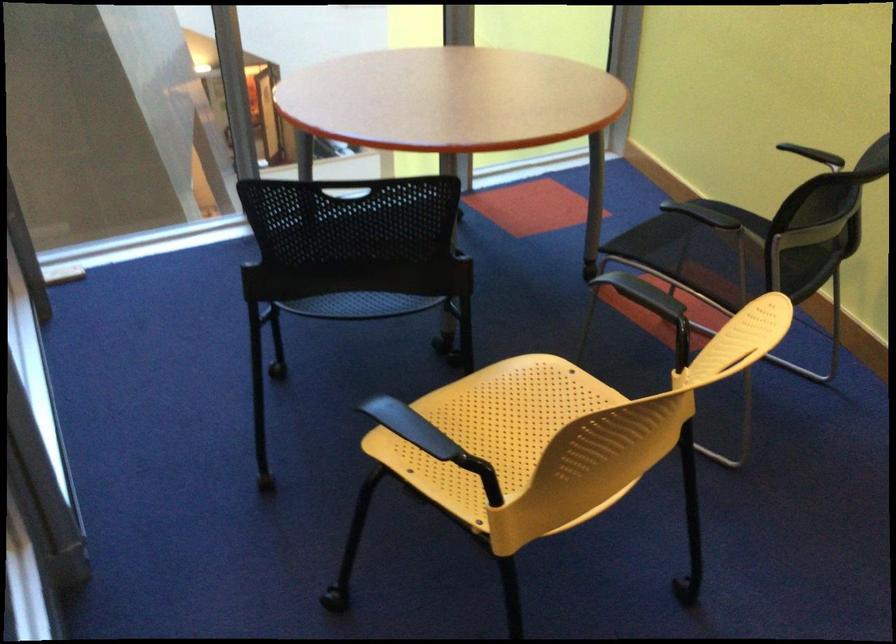
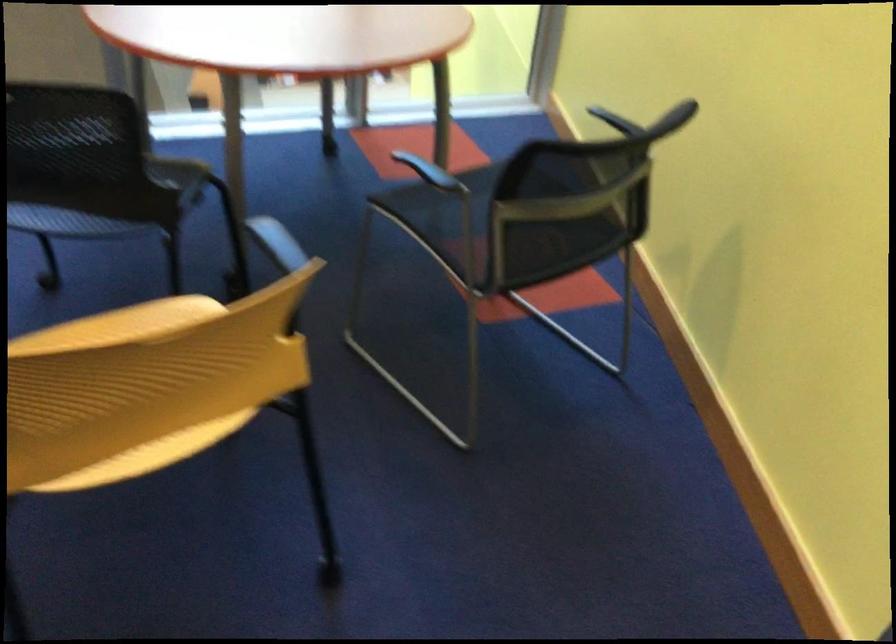
Question: The images are taken continuously from a first-person perspective. In which direction is your viewpoint rotating?

Choices:
 (A) Left
 (B) Right
 (C) Up
 (D) Down

Answer: (D)